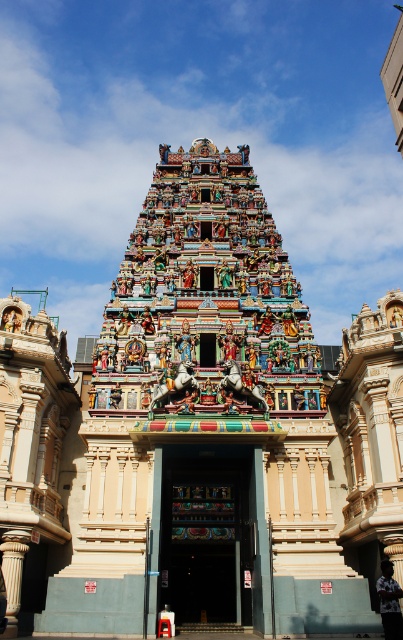
Between wooden carved door at center and white printed shirt at center, which one appears on the right side from the viewer's perspective?

Positioned to the right is white printed shirt at center.

Who is more forward, (x=245, y=616) or (x=386, y=596)?

Point (x=386, y=596) is more forward.

Does point (207, 460) come closer to viewer compared to point (386, 593)?

No, (207, 460) is further to viewer.

I want to click on wooden carved door at center, so click(207, 532).

The width and height of the screenshot is (403, 640). What do you see at coordinates (205, 296) in the screenshot?
I see `multicolored carved temple at center` at bounding box center [205, 296].

Does point (255, 314) lie in front of point (172, 560)?

No, (255, 314) is behind (172, 560).

The image size is (403, 640). In order to click on multicolored carved temple at center in this screenshot , I will do `click(205, 296)`.

Between multicolored carved temple at center and white printed shirt at center, which one has more height?

multicolored carved temple at center is taller.

Is point (108, 372) more distant than point (394, 612)?

That is True.

Identify the location of multicolored carved temple at center. The height and width of the screenshot is (640, 403). (205, 296).